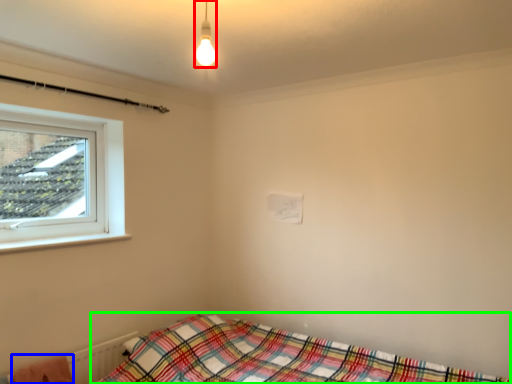
Question: Based on their relative distances, which object is farther from light fixture (highlighted by a red box)? Choose from blanket (highlighted by a blue box) and bed (highlighted by a green box).

Choices:
 (A) blanket
 (B) bed

Answer: (A)